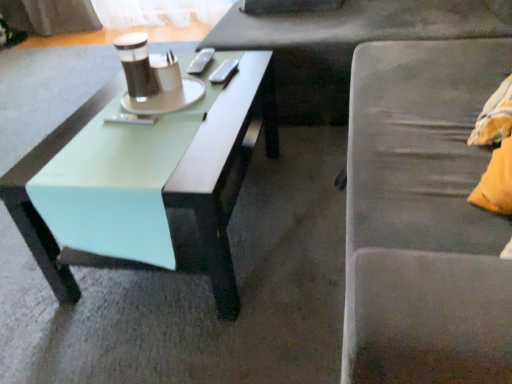
Find the location of a particular element. This screenshot has height=384, width=512. free point to the right of matte black remote control at center, arranged as the 1th remote control when ordered from the bottom is located at coordinates (180, 113).